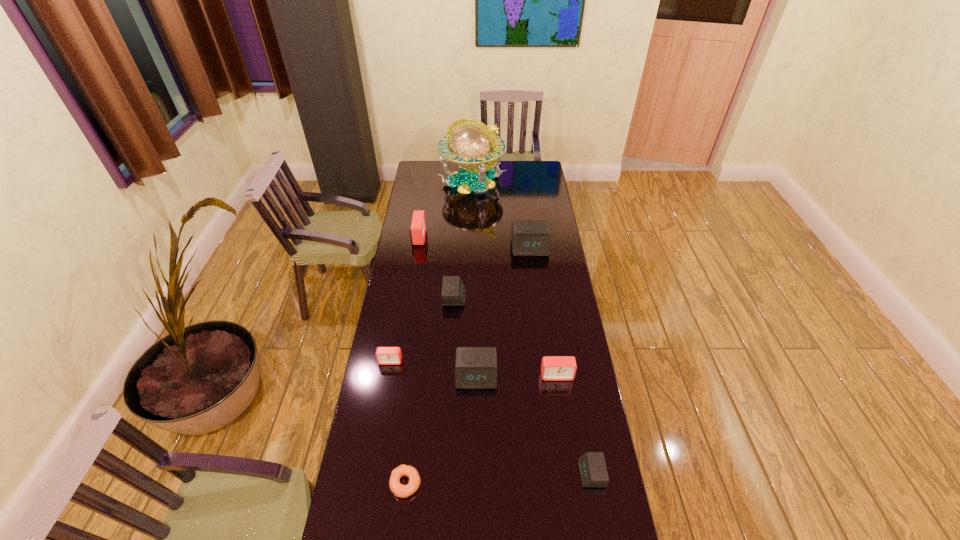
This screenshot has width=960, height=540. What are the coordinates of `the tallest object` in the screenshot? It's located at (472, 145).

Find the location of a particular element. The width and height of the screenshot is (960, 540). globe is located at coordinates (472, 145).

This screenshot has width=960, height=540. In order to click on the biggest red alarm clock in this screenshot , I will do `click(417, 230)`.

Find the location of a particular element. the farthest black alarm clock is located at coordinates (529, 237).

The width and height of the screenshot is (960, 540). I want to click on the third farthest black alarm clock, so click(475, 367).

Locate an element on the screen. Image resolution: width=960 pixels, height=540 pixels. the rightmost red alarm clock is located at coordinates (553, 368).

Locate an element on the screen. the second smallest red alarm clock is located at coordinates (553, 368).

Image resolution: width=960 pixels, height=540 pixels. I want to click on the sixth nearest object, so click(453, 290).

Find the location of a particular element. This screenshot has width=960, height=540. the third farthest alarm clock is located at coordinates click(453, 290).

The height and width of the screenshot is (540, 960). Find the location of `the smallest red alarm clock`. the smallest red alarm clock is located at coordinates (384, 355).